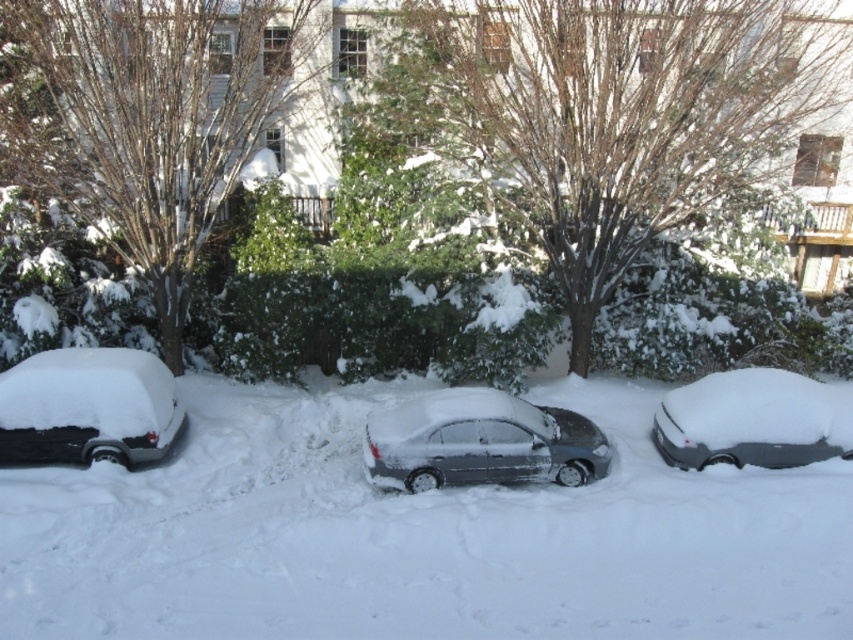
Between point (538, 8) and point (483, 483), which one is positioned behind?

Positioned behind is point (538, 8).

This screenshot has height=640, width=853. Identify the location of brown textured tree at center. (608, 113).

Identify the location of brown textured tree at center. [608, 113].

Locate an element on the screen. This screenshot has width=853, height=640. brown textured tree at center is located at coordinates (608, 113).

Based on the photo, can you confirm if brown textured tree at center is positioned to the left of black matte car at left?

Incorrect, brown textured tree at center is not on the left side of black matte car at left.

Is point (717, 188) behind point (180, 410)?

Yes, it is.

At what (x,y) coordinates should I click in order to perform the action: click on brown textured tree at center. Please return your answer as a coordinate pair (x, y). The width and height of the screenshot is (853, 640). Looking at the image, I should click on (608, 113).

Does black matte car at left have a larger size compared to snow-covered sedan at right?

Yes, black matte car at left is bigger than snow-covered sedan at right.

Who is positioned more to the right, black matte car at left or snow-covered sedan at right?

snow-covered sedan at right is more to the right.

Identify the location of black matte car at left. (86, 406).